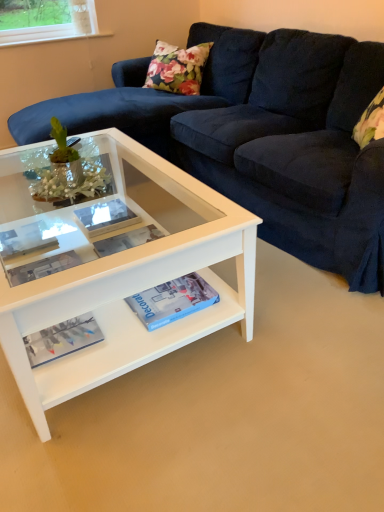
Question: Is point (61, 330) positioned closer to the camera than point (96, 217)?

Choices:
 (A) closer
 (B) farther

Answer: (A)

Question: Is matte blue magazine at lower left in front of or behind matte white paperback book at center, which is counted as the first paperback book, starting from the left, in the image?

Choices:
 (A) front
 (B) behind

Answer: (A)

Question: Which object is the farthest from the velvet dark blue couch at center?

Choices:
 (A) matte blue magazine at lower left
 (B) blue matte paperback book at center, the 2th paperback book when ordered from left to right
 (C) white glossy coffee table at center
 (D) matte white paperback book at center, which is counted as the first paperback book, starting from the left
 (E) matte white book at center

Answer: (A)

Question: Based on their relative distances, which object is farther from the white glossy coffee table at center?

Choices:
 (A) matte white book at center
 (B) matte blue magazine at lower left
 (C) velvet dark blue couch at center
 (D) matte white paperback book at center, placed as the 2th paperback book when sorted from front to back
 (E) blue matte paperback book at center, placed as the first paperback book when sorted from front to back

Answer: (C)